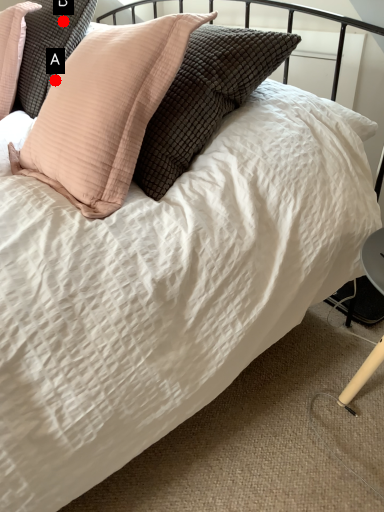
Question: Two points are circled on the image, labeled by A and B beside each circle. Which of the following is the farthest from the observer?

Choices:
 (A) A is further
 (B) B is further

Answer: (B)